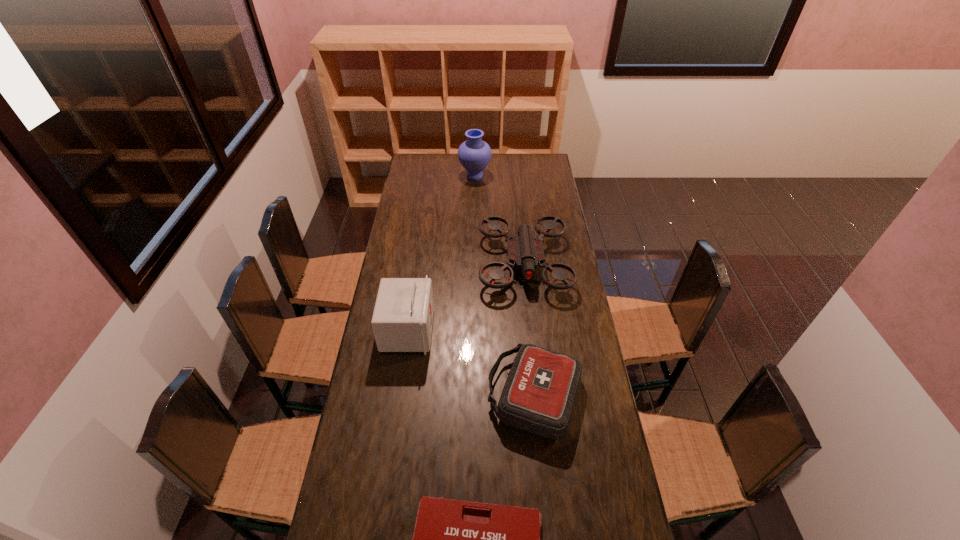
Point out which object is positioned as the third nearest to the shortest first-aid kit. Please provide its 2D coordinates. Your answer should be formatted as a tuple, i.e. [(x, y)], where the tuple contains the x and y coordinates of a point satisfying the conditions above.

[(525, 251)]

This screenshot has width=960, height=540. Find the location of `object that ranks as the third closest to the nearest object`. object that ranks as the third closest to the nearest object is located at coordinates (525, 251).

You are a GUI agent. You are given a task and a screenshot of the screen. Output one action in this format:
    pyautogui.click(x=<x>, y=<y>)
    Task: Click on the first-aid kit identified as the closest to the second shortest first-aid kit
    
    Given the screenshot: What is the action you would take?
    pyautogui.click(x=453, y=539)

Identify the location of the first-aid kit identified as the closest to the second shortest object. (453, 539).

Where is `vacant position in the image that satisfies the following two spatial constraints: 1. on the front-facing side of the third shortest object; 2. on the front-facing side of the second tallest object`? vacant position in the image that satisfies the following two spatial constraints: 1. on the front-facing side of the third shortest object; 2. on the front-facing side of the second tallest object is located at coordinates (531, 330).

At what (x,y) coordinates should I click in order to perform the action: click on free space that satisfies the following two spatial constraints: 1. on the front-facing side of the tallest first-aid kit; 2. on the left side of the second shortest first-aid kit. Please return your answer as a coordinate pair (x, y). The height and width of the screenshot is (540, 960). Looking at the image, I should click on (398, 394).

At what (x,y) coordinates should I click in order to perform the action: click on vacant space that satisfies the following two spatial constraints: 1. on the front-facing side of the second tallest object; 2. on the right side of the second tallest first-aid kit. Please return your answer as a coordinate pair (x, y). Looking at the image, I should click on (398, 394).